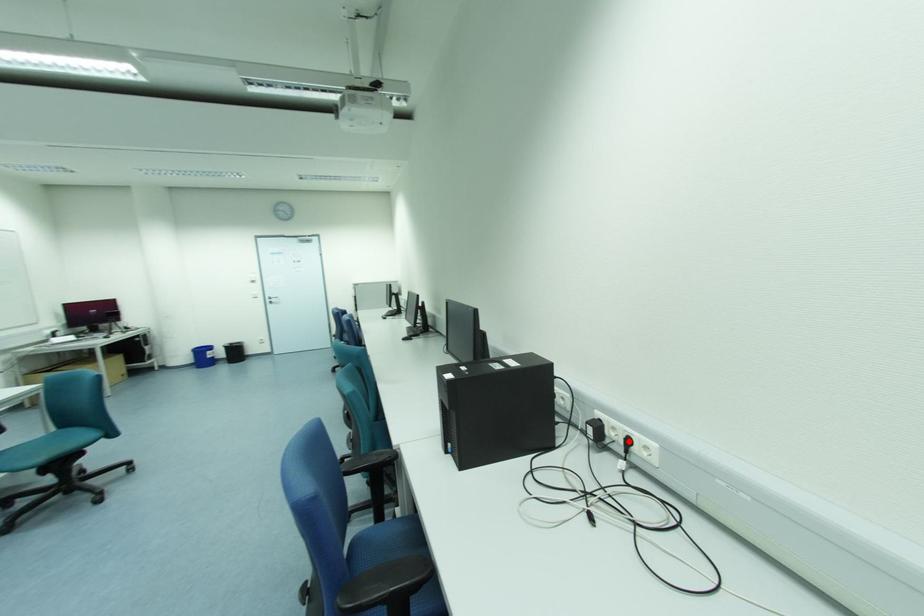
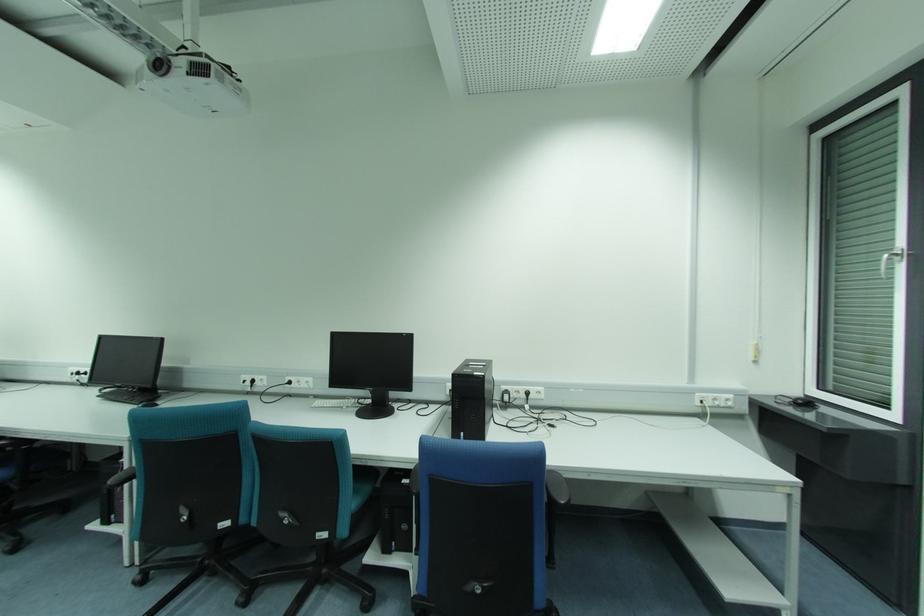
The point at the highlighted location is marked in the first image. Where is the corresponding point in the second image?

(528, 394)